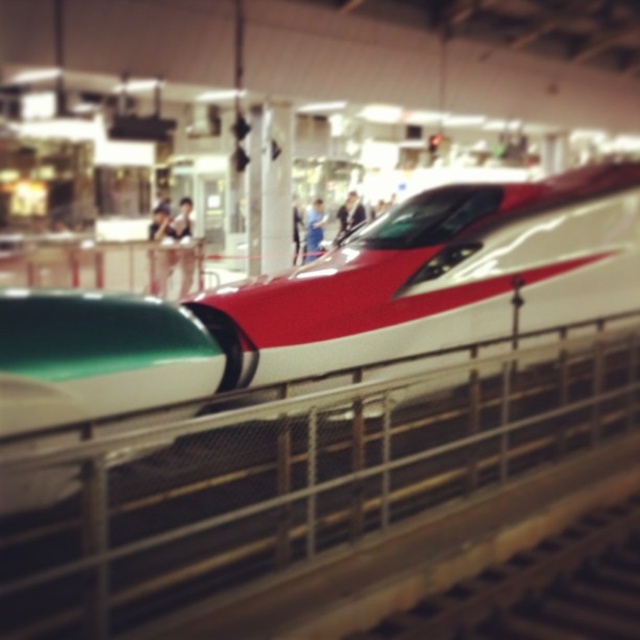
You are an observer standing on the platform at the train station. You notice two people wearing different fabrics at the center of the scene. Which person is closer to you, the blue fabric person at center or the smooth fabric shirt at center?

The blue fabric person at center is closer to you since they are positioned in front of the smooth fabric shirt at center.

In the scene shown: You are standing at the entrance of the train station and want to board the shiny metallic train at center. Given that the entrance is at point 0.0, 0.0 and the platform railing is at point 0.5, 0.5, can you determine if you need to walk towards the left or right to reach the train?

The shiny metallic train at center is located at point (326, 305), which is slightly to the left of the platform railing at (320, 320). Therefore, you should walk towards the left to reach the train.

Based on the photo, you are an event organizer at the train station and need to arrange a photo shoot. You have two models dressed in different outfits. One is wearing a blue fabric person at center and the other has a smooth fabric shirt at center. Which model should you choose if you want someone taller for the main role?

The blue fabric person at center is taller than the smooth fabric shirt at center, so you should choose the model wearing the blue fabric person at center for the main role.